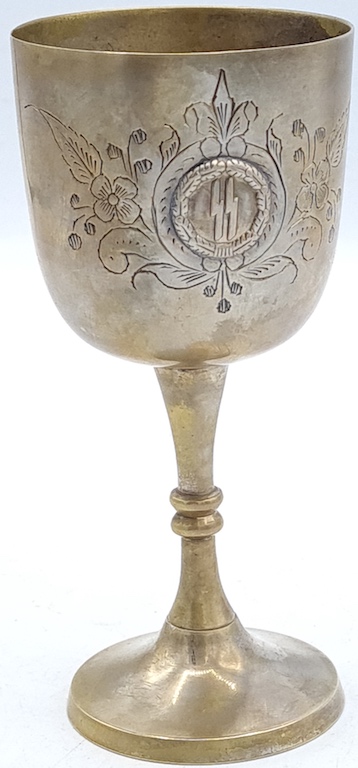
This screenshot has width=358, height=768. I want to click on photo of a goblet, so click(x=11, y=123).